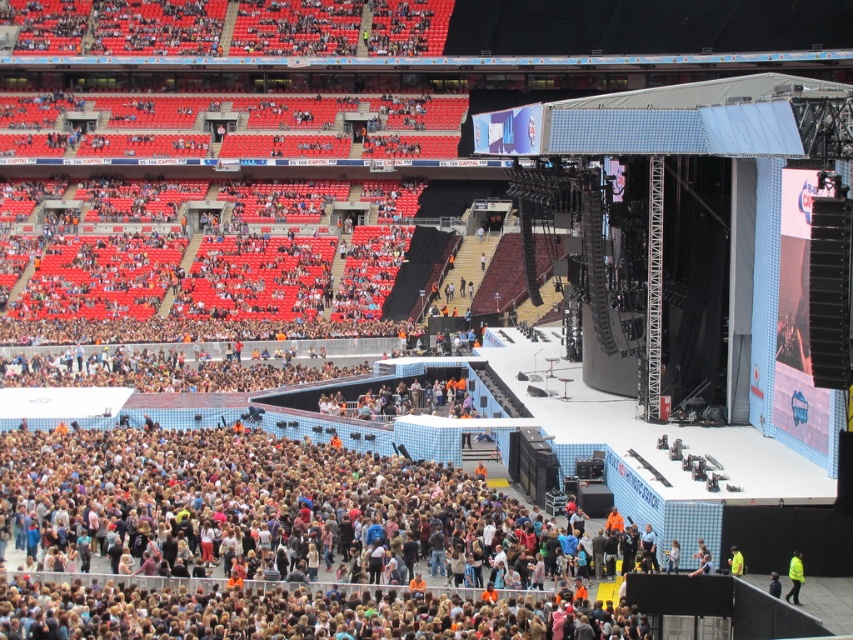
Question: Is yellow reflective vest at lower right to the right of yellow fabric at lower right from the viewer's perspective?

Choices:
 (A) no
 (B) yes

Answer: (B)

Question: Which of the following is the closest to the observer?

Choices:
 (A) yellow fabric at lower right
 (B) yellow reflective vest at lower right

Answer: (B)

Question: Which of the following is the closest to the observer?

Choices:
 (A) (792, 556)
 (B) (737, 566)

Answer: (B)

Question: Is yellow reflective vest at lower right bigger than yellow fabric at lower right?

Choices:
 (A) no
 (B) yes

Answer: (B)

Question: Observing the image, what is the correct spatial positioning of yellow reflective vest at lower right in reference to yellow fabric at lower right?

Choices:
 (A) below
 (B) above

Answer: (A)

Question: Which of the following is the farthest from the observer?

Choices:
 (A) (793, 593)
 (B) (735, 548)

Answer: (B)